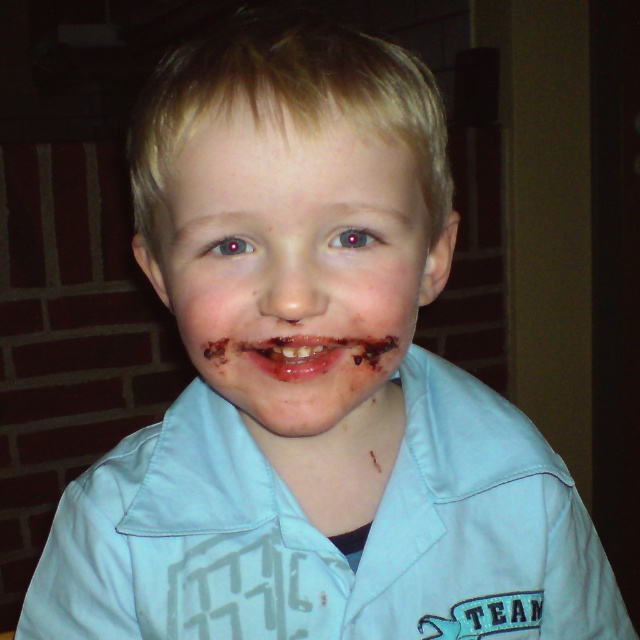
Question: Which object appears farthest from the camera in this image?

Choices:
 (A) reddish-brown glossy lips at center
 (B) chocolate matte face at center

Answer: (A)

Question: Is chocolate matte face at center to the right of reddish-brown glossy lips at center from the viewer's perspective?

Choices:
 (A) yes
 (B) no

Answer: (A)

Question: Where is chocolate matte face at center located in relation to reddish-brown glossy lips at center in the image?

Choices:
 (A) below
 (B) above

Answer: (B)

Question: From the image, what is the correct spatial relationship of chocolate matte face at center in relation to reddish-brown glossy lips at center?

Choices:
 (A) below
 (B) above

Answer: (B)